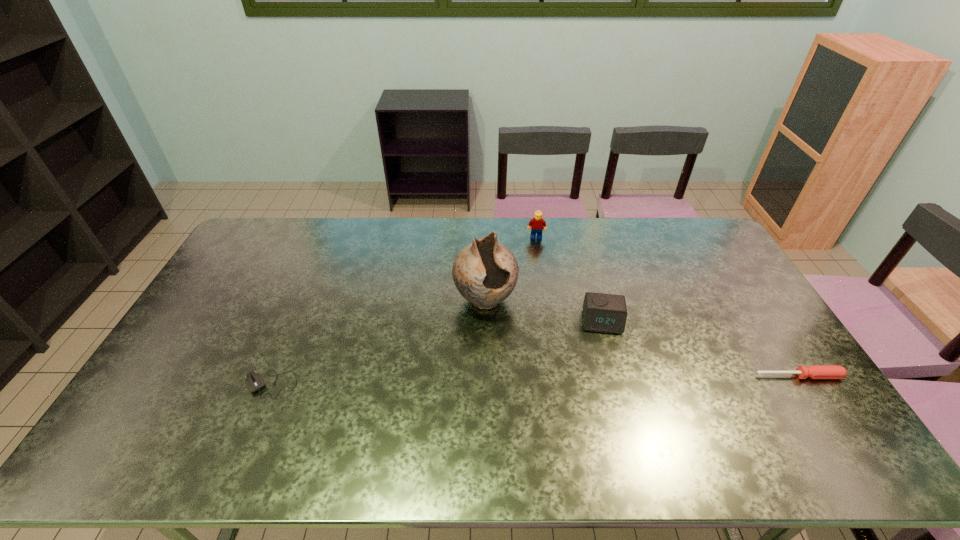
The width and height of the screenshot is (960, 540). In order to click on vacant space on the desktop that is between the leftmost object and the rightmost object and is positioned on the front-facing side of the third object from left to right in this screenshot , I will do `click(543, 380)`.

Find the location of a particular element. Image resolution: width=960 pixels, height=540 pixels. vacant space on the desktop that is between the computer mouse and the rightmost object and is positioned from the spout of the tallest object is located at coordinates (524, 380).

You are a GUI agent. You are given a task and a screenshot of the screen. Output one action in this format:
    pyautogui.click(x=<x>, y=<y>)
    Task: Click on the free space on the desktop that is between the leftmost object and the screwdriver and is positioned on the front-facing side of the alarm clock
    This screenshot has width=960, height=540.
    Given the screenshot: What is the action you would take?
    pyautogui.click(x=608, y=379)